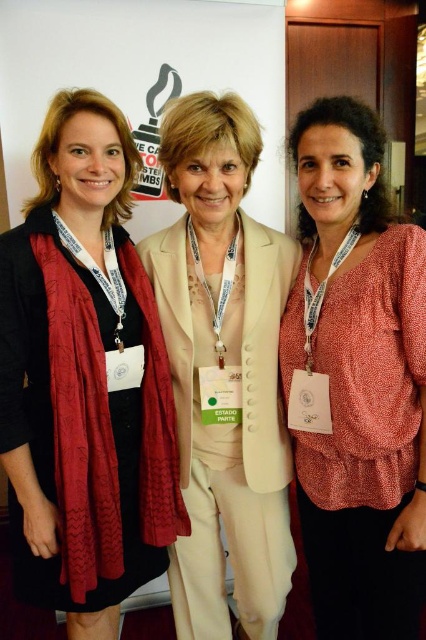
Question: Which object is closer to the camera taking this photo?

Choices:
 (A) metallic gold medal at center
 (B) matte black scarf at left
 (C) matte coral blouse at right
 (D) creamy satin suit at center

Answer: (C)

Question: Which point appears closest to the camera in this image?

Choices:
 (A) (218, 340)
 (B) (340, 529)

Answer: (A)

Question: Does matte coral blouse at right appear under metallic gold medal at center?

Choices:
 (A) yes
 (B) no

Answer: (A)

Question: Is matte black scarf at left positioned at the back of creamy satin suit at center?

Choices:
 (A) yes
 (B) no

Answer: (B)

Question: Does matte coral blouse at right have a larger size compared to metallic gold medal at center?

Choices:
 (A) no
 (B) yes

Answer: (B)

Question: Among these points, which one is nearest to the camera?

Choices:
 (A) (83, 150)
 (B) (216, 352)
 (C) (210, 404)

Answer: (A)